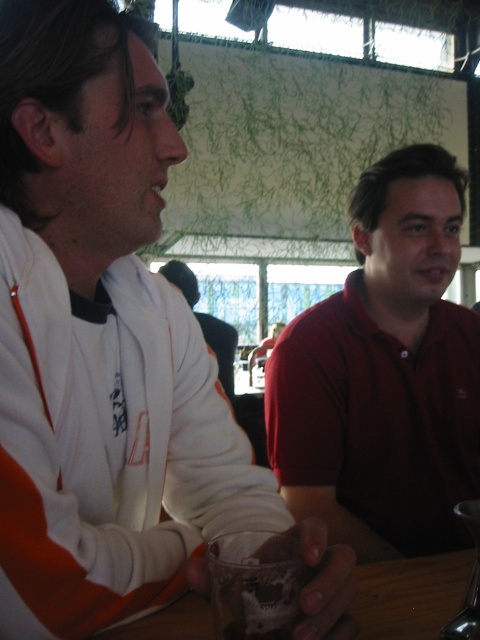
In the scene described, there are two people dressed in matte red shirt at right and matte white shirt at center. Which of these two individuals is positioned to the right of the other?

The matte red shirt at right is positioned to the right of the matte white shirt at center.

In the scene shown: You are a photographer trying to capture a portrait of both the matte red shirt at right and the matte white shirt at center. Since you want both subjects to appear equally sized in the photo, which subject should you move closer to the camera?

The matte red shirt at right is much taller as matte white shirt at center, so to make them appear equally sized in the photo, you should move closer to the matte red shirt at right.

You are designing a layout for a magazine spread and need to place two photos side by side. The photos are of the matte red shirt at right and the matte white shirt at center. Based on their sizes in the original image, which photo should you choose to place on the left side to maintain visual balance?

The matte red shirt at right occupies less space than the matte white shirt at center. To maintain visual balance, place the smaller matte red shirt at right on the left side and the larger matte white shirt at center on the right side.